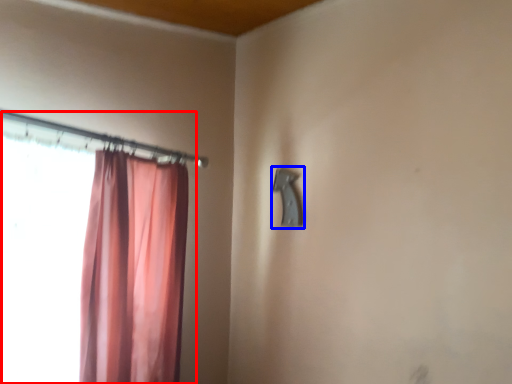
Question: Which point is closer to the camera, curtain (highlighted by a red box) or door handle (highlighted by a blue box)?

Choices:
 (A) curtain
 (B) door handle

Answer: (A)